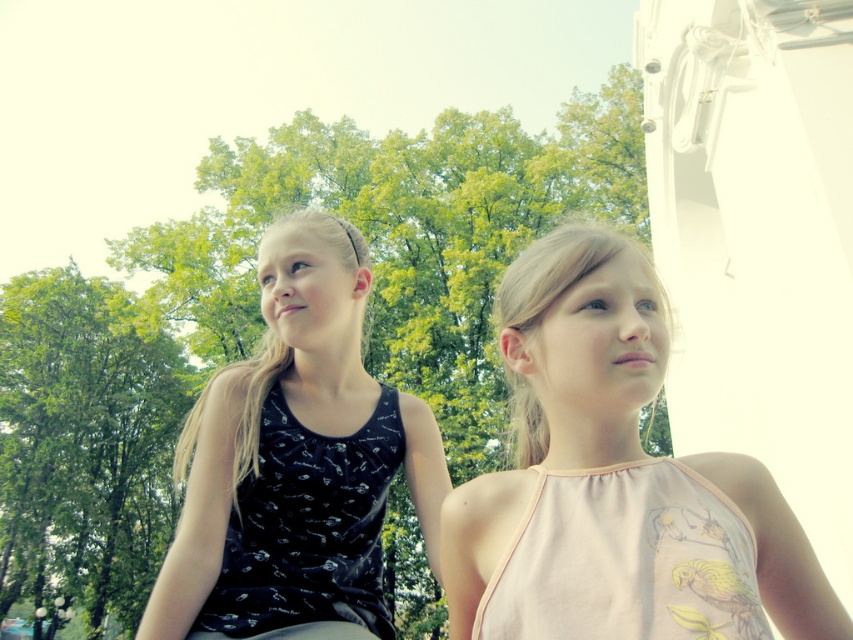
You are a photographer trying to capture a photo of both the black matte tank top at left and the pink fabric dress at center. Since you want both to be clearly visible, which object should you focus on first to ensure proper exposure, considering their sizes?

The black matte tank top at left has a smaller size compared to the pink fabric dress at center. Therefore, you should focus on the black matte tank top at left first to ensure its details are captured clearly before adjusting for the larger pink fabric dress at center.